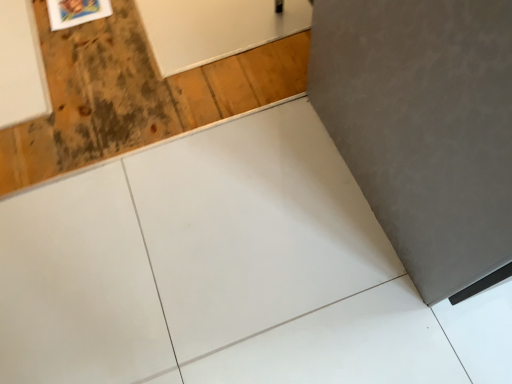
This screenshot has width=512, height=384. Describe the element at coordinates (76, 12) in the screenshot. I see `wooden frame at upper left` at that location.

Find the location of a particular element. wooden frame at upper left is located at coordinates (76, 12).

This screenshot has height=384, width=512. I want to click on wooden plywood at upper left, so click(x=90, y=99).

What do you see at coordinates (90, 99) in the screenshot? The width and height of the screenshot is (512, 384). I see `wooden plywood at upper left` at bounding box center [90, 99].

Measure the distance between point (160, 98) and camera.

1.32 meters.

Where is `wooden frame at upper left`? This screenshot has height=384, width=512. wooden frame at upper left is located at coordinates (76, 12).

Looking at this image, between wooden frame at upper left and wooden plywood at upper left, which one appears on the left side from the viewer's perspective?

From the viewer's perspective, wooden frame at upper left appears more on the left side.

Which object is further away from the camera taking this photo, wooden frame at upper left or wooden plywood at upper left?

Positioned behind is wooden frame at upper left.

Is point (77, 5) closer to viewer compared to point (166, 111)?

No, (77, 5) is behind (166, 111).

From the image's perspective, is wooden frame at upper left on top of wooden plywood at upper left?

Yes, from the image's perspective, wooden frame at upper left is above wooden plywood at upper left.

From a real-world perspective, does wooden frame at upper left stand above wooden plywood at upper left?

Incorrect, from a real-world perspective, wooden frame at upper left is lower than wooden plywood at upper left.

Considering the relative sizes of wooden frame at upper left and wooden plywood at upper left in the image provided, is wooden frame at upper left thinner than wooden plywood at upper left?

Indeed, wooden frame at upper left has a lesser width compared to wooden plywood at upper left.

Can you confirm if wooden frame at upper left is shorter than wooden plywood at upper left?

Incorrect, the height of wooden frame at upper left does not fall short of that of wooden plywood at upper left.

Can you confirm if wooden frame at upper left is bigger than wooden plywood at upper left?

No.

Is wooden frame at upper left outside of wooden plywood at upper left?

No, most part of wooden frame at upper left lies within wooden plywood at upper left.

Would you consider wooden frame at upper left to be distant from wooden plywood at upper left?

wooden frame at upper left is actually quite close to wooden plywood at upper left.

Could you tell me if wooden frame at upper left is facing wooden plywood at upper left?

Yes, wooden frame at upper left is turned towards wooden plywood at upper left.

How different are the orientations of wooden frame at upper left and wooden plywood at upper left in degrees?

177 degrees separate the facing orientations of wooden frame at upper left and wooden plywood at upper left.

This screenshot has height=384, width=512. What are the coordinates of `picture frame on the left side of wooden plywood at upper left` in the screenshot? It's located at (76, 12).

Does wooden plywood at upper left appear on the left side of wooden frame at upper left?

No, wooden plywood at upper left is not to the left of wooden frame at upper left.

In the image, is wooden plywood at upper left positioned in front of or behind wooden frame at upper left?

Visually, wooden plywood at upper left is located in front of wooden frame at upper left.

Considering the positions of point (103, 120) and point (110, 7), is point (103, 120) closer or farther from the camera than point (110, 7)?

Clearly, point (103, 120) is closer to the camera than point (110, 7).

Based on the photo, from the image's perspective, which is below, wooden plywood at upper left or wooden frame at upper left?

wooden plywood at upper left, from the image's perspective.

From a real-world perspective, is wooden plywood at upper left beneath wooden frame at upper left?

No, from a real-world perspective, wooden plywood at upper left is not under wooden frame at upper left.

In terms of width, does wooden plywood at upper left look wider or thinner when compared to wooden frame at upper left?

Clearly, wooden plywood at upper left has more width compared to wooden frame at upper left.

Considering the sizes of objects wooden plywood at upper left and wooden frame at upper left in the image provided, who is taller, wooden plywood at upper left or wooden frame at upper left?

wooden frame at upper left is taller.

Who is bigger, wooden plywood at upper left or wooden frame at upper left?

wooden plywood at upper left.

Is wooden plywood at upper left inside the boundaries of wooden frame at upper left, or outside?

wooden plywood at upper left cannot be found inside wooden frame at upper left.

Are wooden plywood at upper left and wooden frame at upper left located far from each other?

Actually, wooden plywood at upper left and wooden frame at upper left are a little close together.

Is wooden plywood at upper left facing towards wooden frame at upper left?

No.

The height and width of the screenshot is (384, 512). What are the coordinates of `picture frame located underneath the wooden plywood at upper left (from a real-world perspective)` in the screenshot? It's located at point(76,12).

The height and width of the screenshot is (384, 512). I want to click on plywood above the wooden frame at upper left (from a real-world perspective), so click(x=90, y=99).

This screenshot has height=384, width=512. Find the location of `picture frame lying on the left of wooden plywood at upper left`. picture frame lying on the left of wooden plywood at upper left is located at coordinates (76, 12).